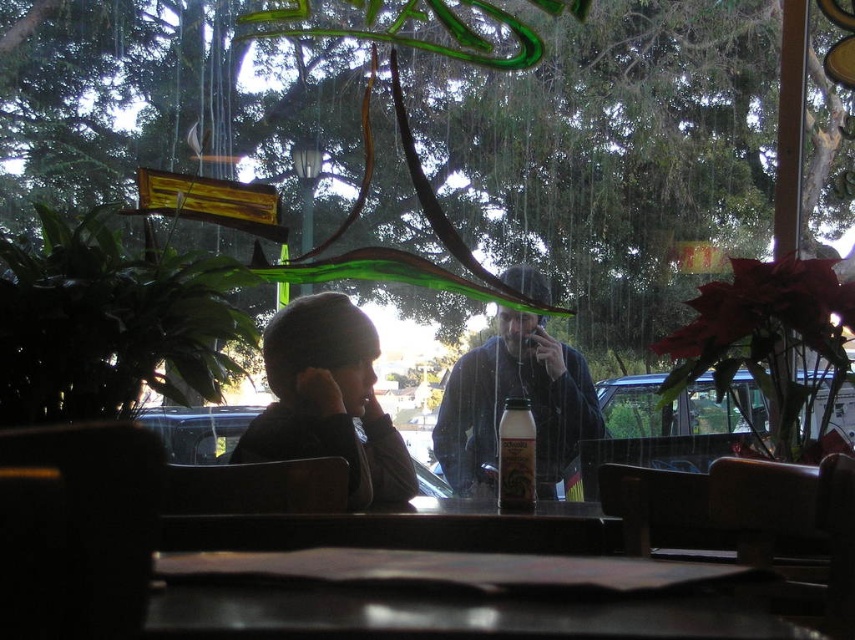
You are standing in the cozy cafe and want to place a small vase on the smooth wooden table at center. To ensure accuracy, what are the exact coordinates where the table is located?

The smooth wooden table at center is located at the 2D coordinates point (x=447, y=596).

You are standing in the cafe and want to place a small decoration between the two points marked as point (529, 566) and point (504, 468) on the table. Which point should the decoration be closer to in order to be nearer to you?

The decoration should be placed closer to point (529, 566) since it is closer to the viewer than point (504, 468).

From the picture: You are a customer sitting at the table in the image. You want to grab the dark blue sweater at center that is on the chair next to you. However, there is a glass of water placed at point (514, 396). Can you reach the sweater without moving the glass?

The point (514, 396) indicates the dark blue sweater at center, so the glass of water is actually placed where the sweater is. Therefore, you cannot reach the sweater without moving the glass.